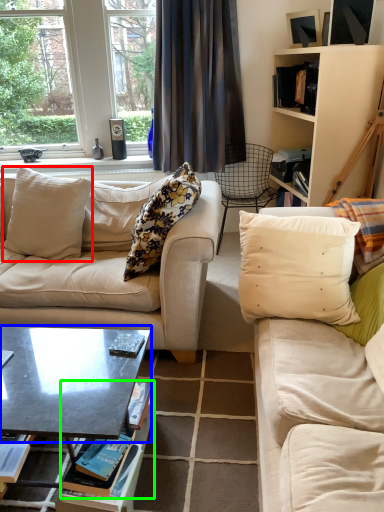
Question: Estimate the real-world distances between objects in this image. Which object is closer to pillow (highlighted by a red box), coffee table (highlighted by a blue box) or book (highlighted by a green box)?

Choices:
 (A) coffee table
 (B) book

Answer: (A)